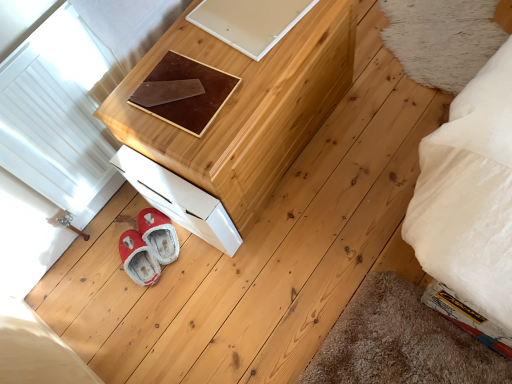
Locate an element on the screen. This screenshot has width=512, height=384. free space to the left of white glossy drawer at lower left is located at coordinates (143, 244).